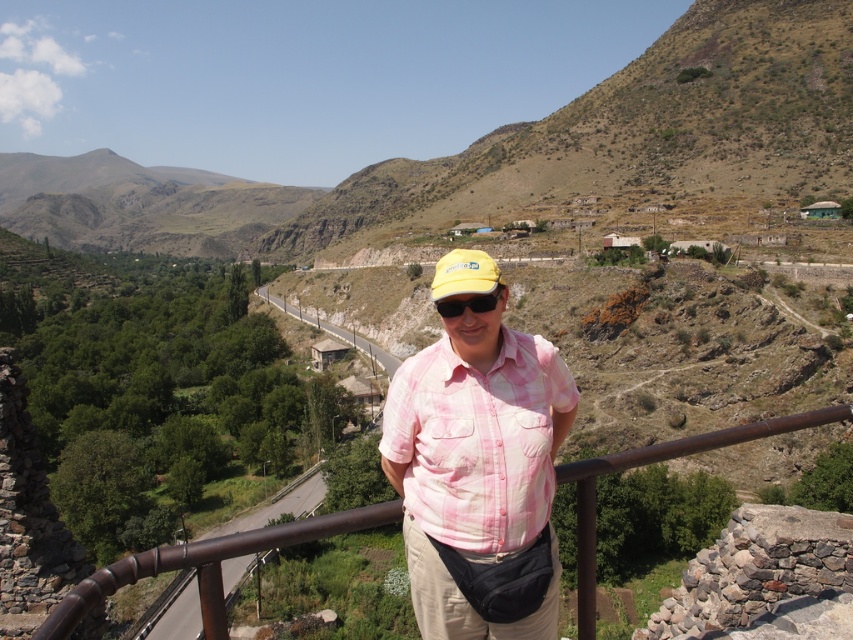
Which is behind, point (434, 296) or point (497, 300)?

The point (434, 296) is more distant.

Measure the distance between point (439, 289) and camera.

Point (439, 289) is 25.80 meters away from camera.

Between point (482, 291) and point (500, 291), which one is positioned behind?

Positioned behind is point (500, 291).

This screenshot has height=640, width=853. Identify the location of yellow fabric cap at center. (463, 273).

Which is more to the left, brown metal/rail at center or yellow matte sunglasses at center?

From the viewer's perspective, yellow matte sunglasses at center appears more on the left side.

Is brown metal/rail at center wider than yellow matte sunglasses at center?

Correct, the width of brown metal/rail at center exceeds that of yellow matte sunglasses at center.

This screenshot has height=640, width=853. What are the coordinates of `brown metal/rail at center` in the screenshot? It's located at (206, 564).

At what (x,y) coordinates should I click in order to perform the action: click on brown metal/rail at center. Please return your answer as a coordinate pair (x, y). This screenshot has height=640, width=853. Looking at the image, I should click on (206, 564).

Locate an element on the screen. This screenshot has width=853, height=640. pink plaid shirt at center is located at coordinates (479, 476).

Can you confirm if pink plaid shirt at center is shorter than yellow matte sunglasses at center?

Incorrect, pink plaid shirt at center's height does not fall short of yellow matte sunglasses at center's.

Who is more forward, (479, 524) or (469, 298)?

Point (479, 524) is more forward.

Identify the location of pink plaid shirt at center. (479, 476).